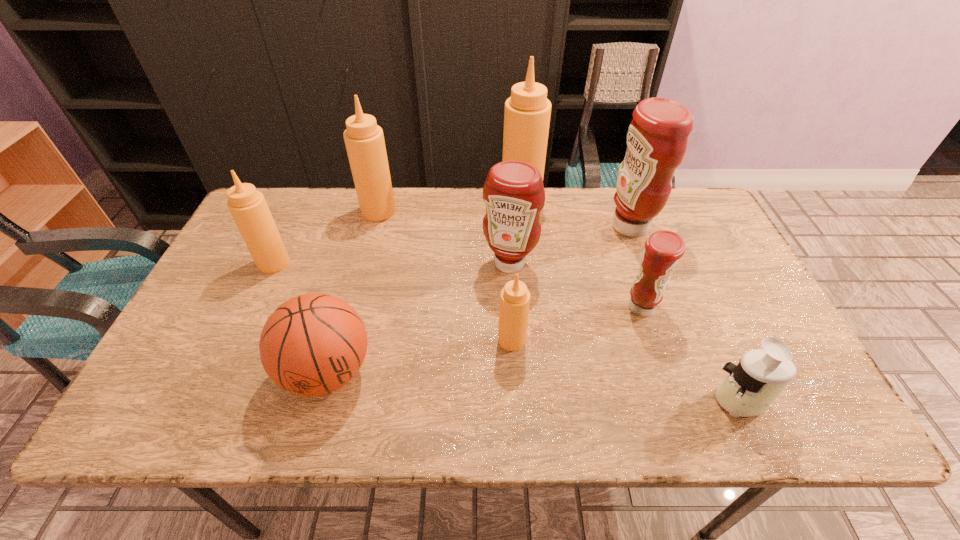
Locate an element on the screen. The height and width of the screenshot is (540, 960). the biggest tan condiment is located at coordinates (527, 113).

Locate an element on the screen. the tallest condiment is located at coordinates (527, 113).

The width and height of the screenshot is (960, 540). Find the location of `the third smallest tan condiment`. the third smallest tan condiment is located at coordinates (364, 140).

The height and width of the screenshot is (540, 960). In order to click on the sixth condiment from right to left in this screenshot , I will do click(x=364, y=140).

Where is `the biggest red condiment`? the biggest red condiment is located at coordinates (657, 137).

The height and width of the screenshot is (540, 960). Identify the location of the third farthest tan condiment. (248, 207).

In order to click on the leftmost object in this screenshot , I will do `click(248, 207)`.

The height and width of the screenshot is (540, 960). I want to click on the second nearest red condiment, so click(x=513, y=192).

You are a GUI agent. You are given a task and a screenshot of the screen. Output one action in this format:
    pyautogui.click(x=<x>, y=<y>)
    Task: Click on the second biggest red condiment
    
    Given the screenshot: What is the action you would take?
    pyautogui.click(x=513, y=192)

Locate an element on the screen. the nearest red condiment is located at coordinates click(663, 249).